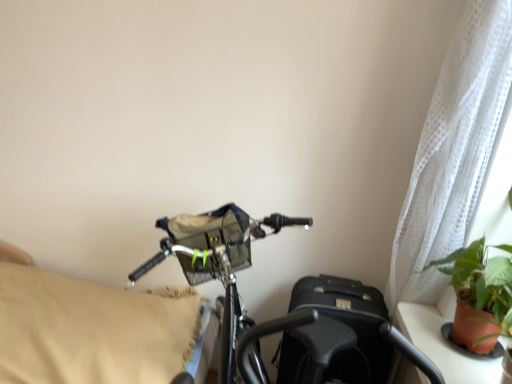
Question: Which is correct: shiny metallic bicycle at center is inside green leafy plant in terracotta pot at right, or outside of it?

Choices:
 (A) inside
 (B) outside

Answer: (B)

Question: From the image's perspective, is shiny metallic bicycle at center positioned above or below green leafy plant in terracotta pot at right?

Choices:
 (A) above
 (B) below

Answer: (B)

Question: Based on their relative distances, which object is farther from the shiny metallic bicycle at center?

Choices:
 (A) beige fabric pillow at left
 (B) white sheer curtain at upper right
 (C) green leafy plant in terracotta pot at right

Answer: (B)

Question: Estimate the real-world distances between objects in this image. Which object is closer to the shiny metallic bicycle at center?

Choices:
 (A) beige fabric pillow at left
 (B) white sheer curtain at upper right
 (C) green leafy plant in terracotta pot at right

Answer: (A)